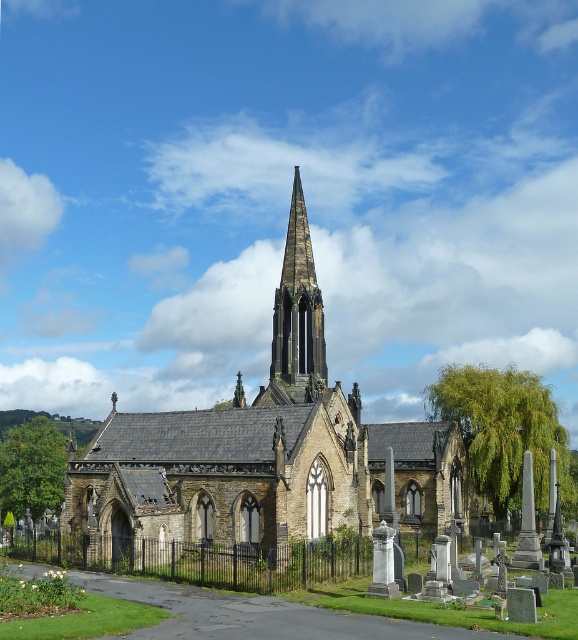
Consider the image. You are standing in front of the brown stone church at center and want to take a photo of the smooth stone spire at center. Since the spire is part of the church, will it appear smaller in the photo compared to the church?

The brown stone church at center is closer to the viewer than the smooth stone spire at center. Since the spire is further away, it will appear smaller in the photo compared to the church.

You are standing outside the brown stone church at center and want to take a photo of it. If your camera has a maximum focus range of 200 feet, will you be able to capture the church clearly?

The brown stone church at center is 204.20 feet away from the viewer. Since the camera can only focus up to 200 feet, it will not be able to capture the church clearly.

You are a visitor standing at the entrance of the brown stone church at center. You want to take a photo of the smooth stone spire at center. Which direction should you look to capture the spire in your photo?

The smooth stone spire at center is part of the brown stone church at center, so you should look upward to capture the spire in your photo since the spire is positioned above the church.